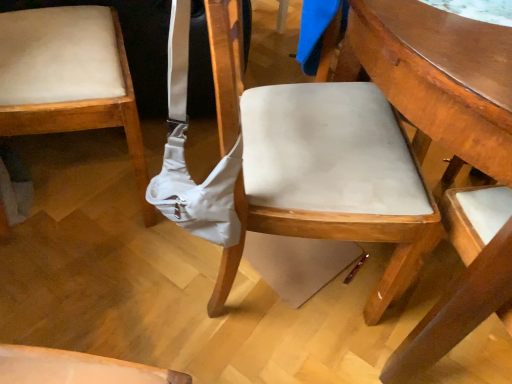
Question: From the image's perspective, does wooden table at center appear lower than matte white chair at center, which is the first chair from right to left?

Choices:
 (A) yes
 (B) no

Answer: (A)

Question: Is there a large distance between wooden table at center and matte white chair at center, the 2th chair viewed from the left?

Choices:
 (A) no
 (B) yes

Answer: (A)

Question: From a real-world perspective, is wooden table at center physically above matte white chair at center, the 2th chair viewed from the left?

Choices:
 (A) yes
 (B) no

Answer: (B)

Question: Is the position of wooden table at center more distant than that of matte white chair at center, which is the first chair from right to left?

Choices:
 (A) yes
 (B) no

Answer: (B)

Question: Considering the relative sizes of wooden table at center and matte white chair at center, which is the first chair from right to left, in the image provided, is wooden table at center bigger than matte white chair at center, which is the first chair from right to left,?

Choices:
 (A) yes
 (B) no

Answer: (A)

Question: Is wooden table at center at the left side of matte white chair at center, the 2th chair viewed from the left?

Choices:
 (A) no
 (B) yes

Answer: (A)

Question: Is matte beige cushion at left, the 2th chair when ordered from right to left, surrounded by matte white chair at center, the 2th chair viewed from the left?

Choices:
 (A) no
 (B) yes

Answer: (A)

Question: Considering the relative sizes of matte white chair at center, which is the first chair from right to left, and matte beige cushion at left, the 2th chair when ordered from right to left, in the image provided, is matte white chair at center, which is the first chair from right to left, thinner than matte beige cushion at left, the 2th chair when ordered from right to left,?

Choices:
 (A) no
 (B) yes

Answer: (A)

Question: Is matte beige cushion at left, the 2th chair when ordered from right to left, at the back of matte white chair at center, which is the first chair from right to left?

Choices:
 (A) no
 (B) yes

Answer: (B)

Question: Is there a large distance between matte white chair at center, which is the first chair from right to left, and matte beige cushion at left, which is the 1th chair from left to right?

Choices:
 (A) yes
 (B) no

Answer: (B)

Question: Are matte white chair at center, the 2th chair viewed from the left, and matte beige cushion at left, the 2th chair when ordered from right to left, beside each other?

Choices:
 (A) yes
 (B) no

Answer: (B)

Question: From a real-world perspective, is matte white chair at center, the 2th chair viewed from the left, located beneath matte beige cushion at left, which is the 1th chair from left to right?

Choices:
 (A) no
 (B) yes

Answer: (A)

Question: Is matte beige cushion at left, the 2th chair when ordered from right to left, to the right of wooden table at center from the viewer's perspective?

Choices:
 (A) no
 (B) yes

Answer: (A)